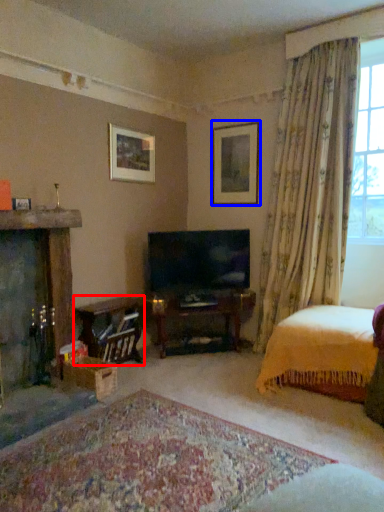
Question: Which of the following is the closest to the observer, table (highlighted by a red box) or picture frame (highlighted by a blue box)?

Choices:
 (A) table
 (B) picture frame

Answer: (A)